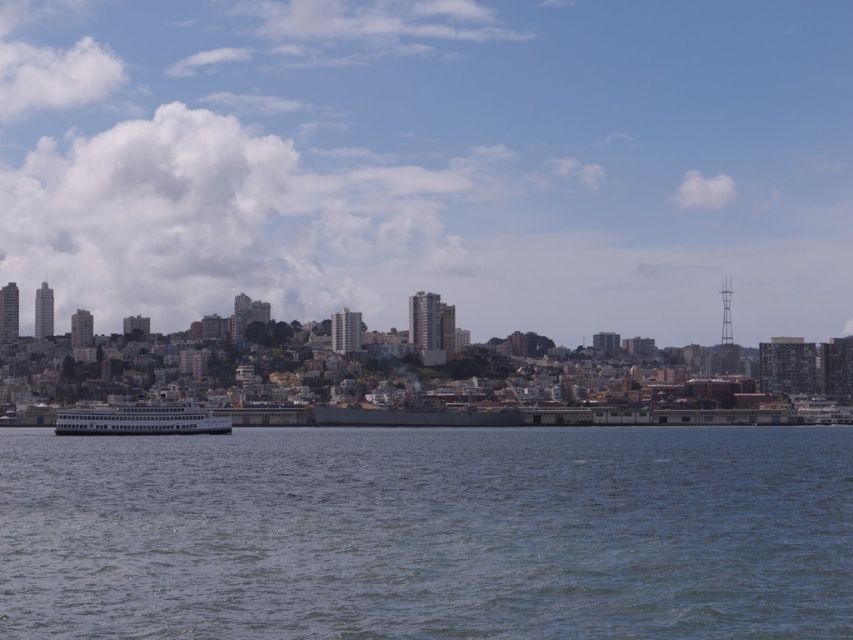
Which is more to the left, blue water at center or white matte ferry at center?

white matte ferry at center is more to the left.

Is blue water at center to the right of white matte ferry at center from the viewer's perspective?

Yes, blue water at center is to the right of white matte ferry at center.

Locate an element on the screen. This screenshot has height=640, width=853. blue water at center is located at coordinates (428, 532).